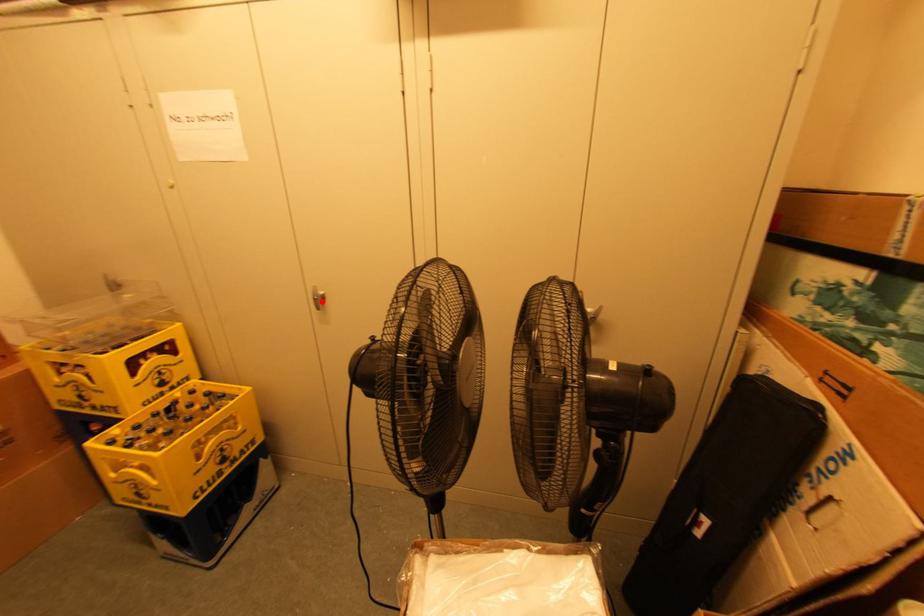
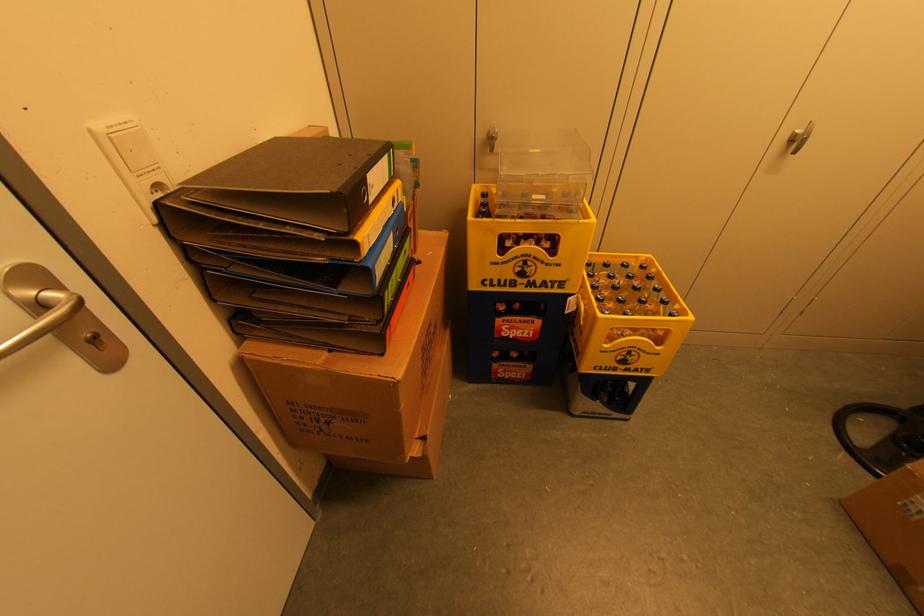
In the second image, find the point that corresponds to the highlighted location in the first image.

(798, 142)